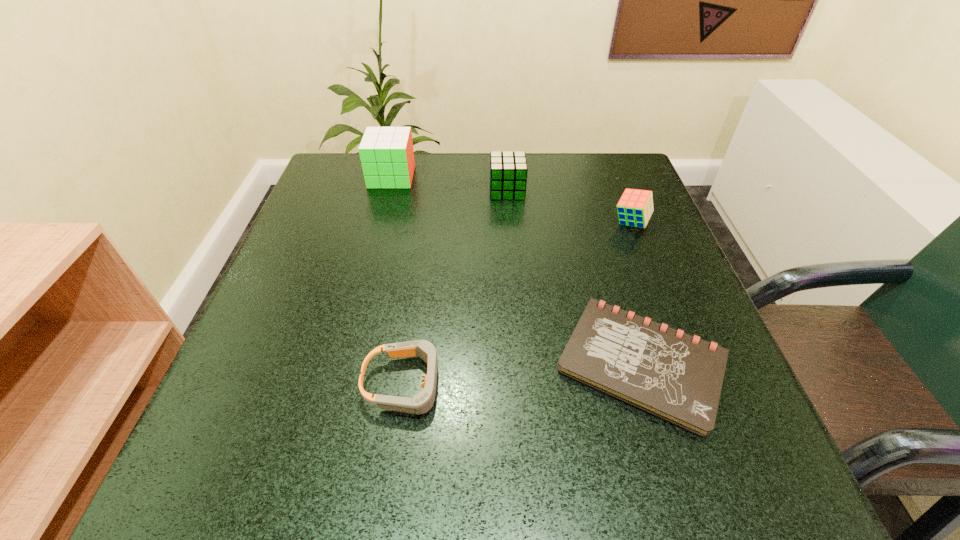
Image resolution: width=960 pixels, height=540 pixels. In order to click on the leftmost cube in this screenshot , I will do `click(386, 153)`.

I want to click on the tallest object, so click(x=386, y=153).

What are the coordinates of `the second cube from left to right` in the screenshot? It's located at (508, 170).

Identify the location of the third nearest object. (635, 207).

In order to click on the rightmost cube in this screenshot , I will do `click(635, 207)`.

The height and width of the screenshot is (540, 960). Identify the location of goggles. (422, 402).

Image resolution: width=960 pixels, height=540 pixels. I want to click on notebook, so click(677, 377).

You are a GUI agent. You are given a task and a screenshot of the screen. Output one action in this format:
    pyautogui.click(x=<x>, y=<y>)
    Task: Click on the free space located on the right of the leftmost cube
    Image resolution: width=960 pixels, height=540 pixels.
    Given the screenshot: What is the action you would take?
    pyautogui.click(x=463, y=177)

Identify the location of vacant space located 0.110m on the back of the second cube from left to right. (504, 157).

The height and width of the screenshot is (540, 960). Find the location of `vacant space located on the front of the nearest cube`. vacant space located on the front of the nearest cube is located at coordinates tap(690, 375).